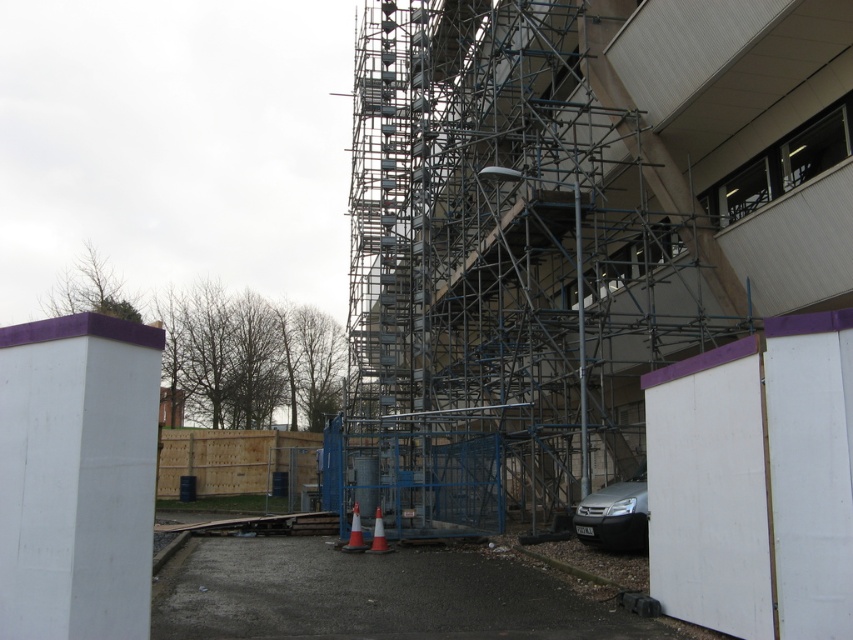
Question: Can you confirm if metal scaffolding at center is bigger than orange reflective cone at lower center?

Choices:
 (A) yes
 (B) no

Answer: (A)

Question: Which point is closer to the camera?

Choices:
 (A) (379, 550)
 (B) (664, 356)

Answer: (A)

Question: Does orange reflective cone at lower center appear over orange plastic cone at lower center?

Choices:
 (A) yes
 (B) no

Answer: (B)

Question: Does metal scaffolding at center appear on the left side of orange plastic cone at lower center?

Choices:
 (A) no
 (B) yes

Answer: (A)

Question: Estimate the real-world distances between objects in this image. Which object is closer to the orange reflective cone at lower center?

Choices:
 (A) satin silver car at lower right
 (B) orange plastic cone at lower center
 (C) metal scaffolding at center

Answer: (B)

Question: Estimate the real-world distances between objects in this image. Which object is farther from the orange plastic cone at lower center?

Choices:
 (A) metal scaffolding at center
 (B) orange reflective cone at lower center

Answer: (A)